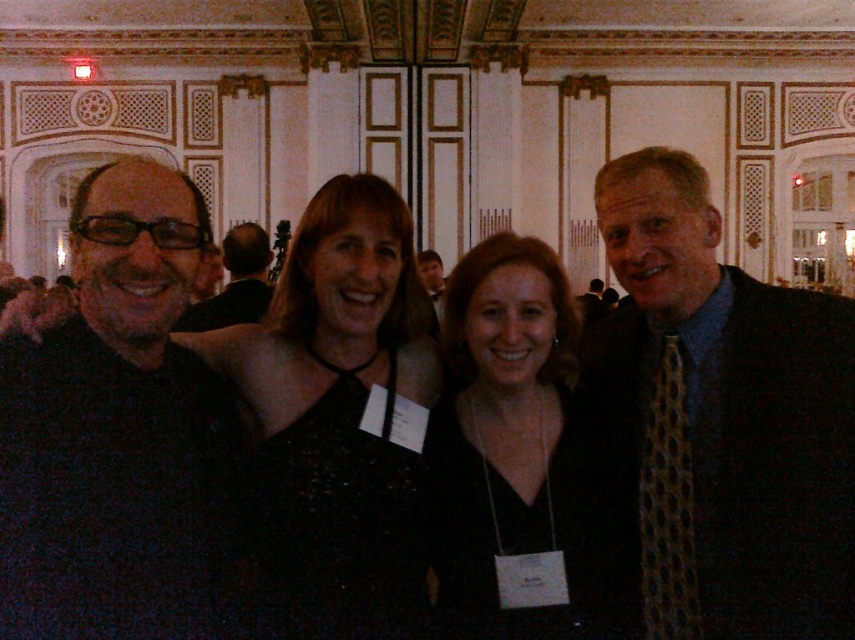
Question: Does matte black glasses at left have a lesser width compared to matte black suit at center?

Choices:
 (A) no
 (B) yes

Answer: (A)

Question: Where is patterned silk tie at right located in relation to black matte shirt at left in the image?

Choices:
 (A) below
 (B) above

Answer: (B)

Question: Which object is farther from the camera taking this photo?

Choices:
 (A) black fabric dress at center
 (B) matte black glasses at left

Answer: (B)

Question: Is patterned silk tie at right wider than matte black suit at center?

Choices:
 (A) yes
 (B) no

Answer: (A)

Question: Which point is farther to the camera?

Choices:
 (A) patterned silk tie at right
 (B) matte black suit at center
 (C) matte black glasses at left
 (D) black matte shirt at left

Answer: (C)

Question: Which object is farther from the camera taking this photo?

Choices:
 (A) black matte shirt at left
 (B) patterned silk tie at right
 (C) black fabric dress at center
 (D) matte black glasses at left

Answer: (D)